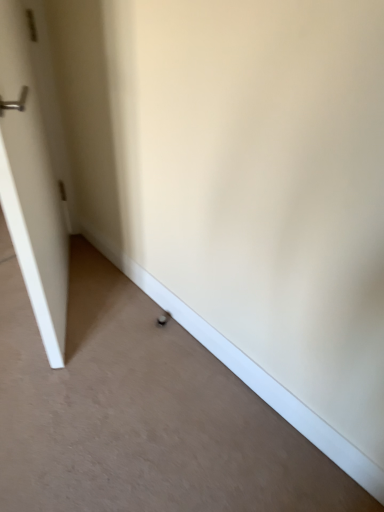
The image size is (384, 512). Describe the element at coordinates (141, 414) in the screenshot. I see `smooth beige concrete at lower center` at that location.

Consider the image. What is the approximate height of smooth beige concrete at lower center?

0.75 inches.

Where is `smooth beige concrete at lower center`? The height and width of the screenshot is (512, 384). smooth beige concrete at lower center is located at coordinates (141, 414).

At what (x,y) coordinates should I click in order to perform the action: click on smooth beige concrete at lower center. Please return your answer as a coordinate pair (x, y). Looking at the image, I should click on [x=141, y=414].